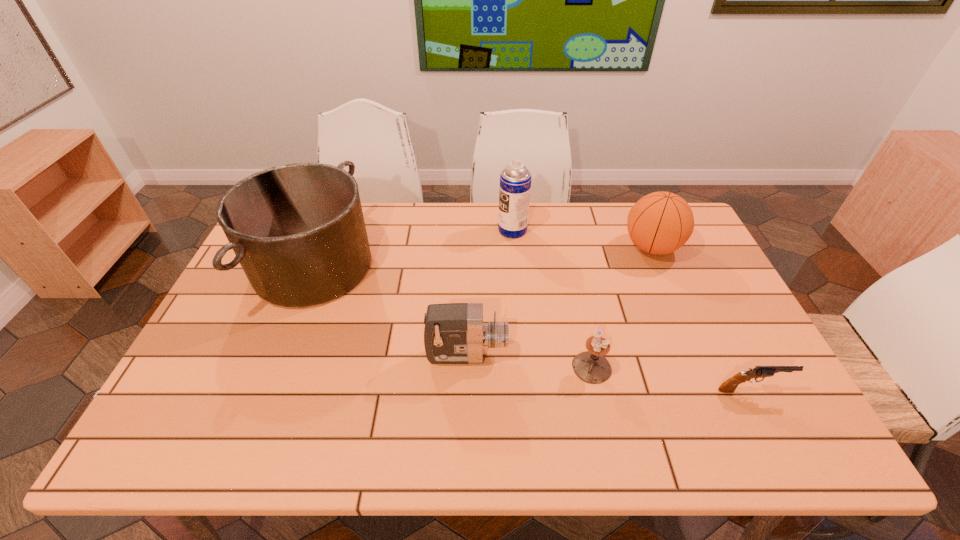
Where is `aerosol can`? The image size is (960, 540). aerosol can is located at coordinates (515, 180).

Find the location of a particular element. The width and height of the screenshot is (960, 540). pan is located at coordinates (298, 231).

Identify the location of basketball. This screenshot has width=960, height=540. (659, 223).

In order to click on camcorder in this screenshot , I will do `click(454, 333)`.

Find the location of a particular element. Image resolution: width=960 pixels, height=540 pixels. the fifth tallest object is located at coordinates (591, 366).

Locate an element on the screen. This screenshot has width=960, height=540. candle holder is located at coordinates (591, 366).

Identify the location of gun. The width and height of the screenshot is (960, 540). (729, 386).

Image resolution: width=960 pixels, height=540 pixels. What are the coordinates of `the shortest object` in the screenshot? It's located at (729, 386).

Identify the location of free space located on the label side of the aerosol can. This screenshot has height=540, width=960. (440, 230).

Locate an element on the screen. free space located on the label side of the aerosol can is located at coordinates pyautogui.click(x=452, y=230).